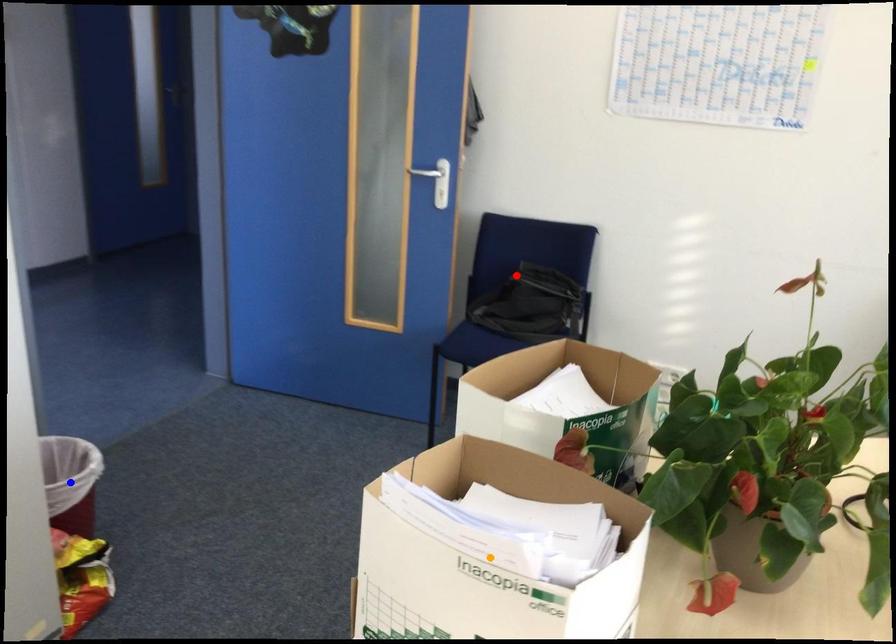
Order these from nearest to farthest:
A) blue point
B) red point
C) orange point

orange point → blue point → red point